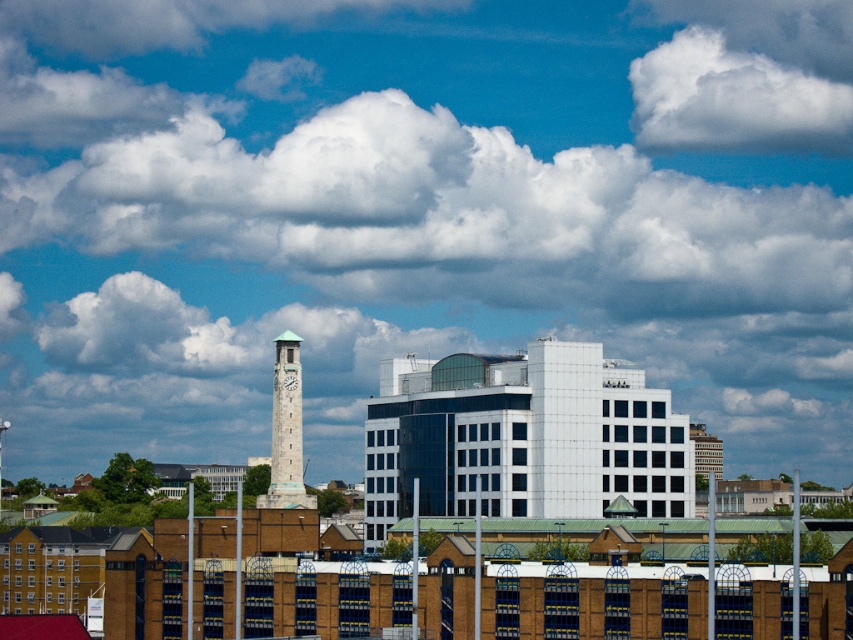
Between point (285, 451) and point (292, 381), which one is positioned in front?

Positioned in front is point (285, 451).

Does green stone clock tower at left have a smaller size compared to white stone clock tower at center-left?

Actually, green stone clock tower at left might be larger than white stone clock tower at center-left.

Does point (299, 444) come closer to viewer compared to point (293, 378)?

No.

You are a GUI agent. You are given a task and a screenshot of the screen. Output one action in this format:
    pyautogui.click(x=<x>, y=<y>)
    Task: Click on the green stone clock tower at left
    This screenshot has width=853, height=640.
    Given the screenshot: What is the action you would take?
    pyautogui.click(x=286, y=432)

Between white fluffy cloud at upper center and white stone clock tower at center-left, which one has more height?

Standing taller between the two is white fluffy cloud at upper center.

Can you confirm if white fluffy cloud at upper center is bigger than white stone clock tower at center-left?

Yes.

Is point (723, 92) farther from viewer compared to point (288, 388)?

Yes, point (723, 92) is behind point (288, 388).

Where is `white fluffy cloud at upper center`? Image resolution: width=853 pixels, height=640 pixels. white fluffy cloud at upper center is located at coordinates (746, 88).

Is white fluffy cloud at upper center behind green stone clock tower at left?

Yes, it is.

Is white fluffy cloud at upper center to the right of green stone clock tower at left from the viewer's perspective?

Yes, white fluffy cloud at upper center is to the right of green stone clock tower at left.

Find the location of a particular element. Image resolution: width=853 pixels, height=640 pixels. white fluffy cloud at upper center is located at coordinates (746, 88).